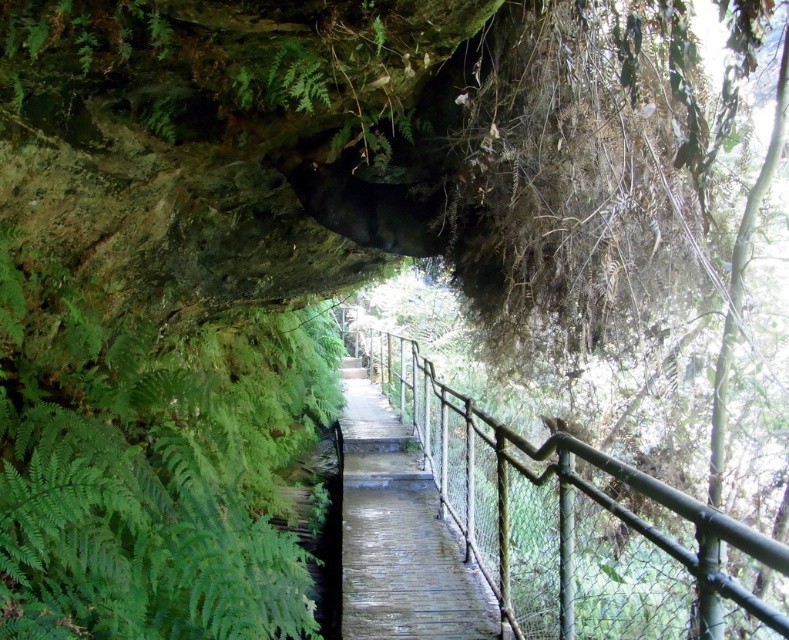
You are standing on the elevated wooden pathway and want to move from one point to another. You have two options to choose from. The first option is to go to point [2,237] and the second option is to go to point [503,528]. Which point is closer to you?

Point [2,237] is closer to you than point [503,528].